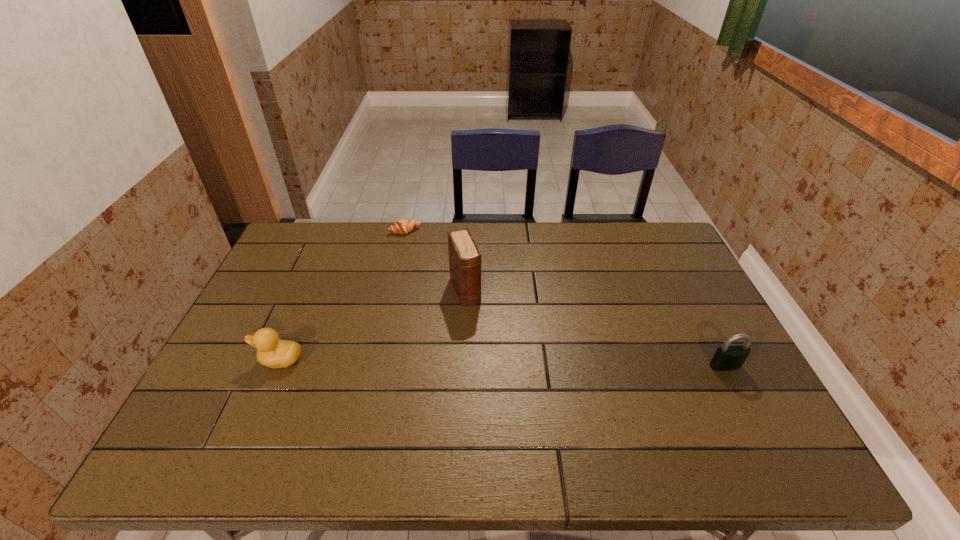
Image resolution: width=960 pixels, height=540 pixels. I want to click on vacant area situated 0.230m on the spine side of the diary, so click(x=495, y=368).

You are a GUI agent. You are given a task and a screenshot of the screen. Output one action in this format:
    pyautogui.click(x=<x>, y=<y>)
    Task: Click on the vacant space located 0.120m on the spine side of the diary
    The image size is (960, 540).
    Given the screenshot: What is the action you would take?
    pyautogui.click(x=482, y=337)

At what (x,y) coordinates should I click in order to perform the action: click on vacant space located 0.270m on the spine side of the diary. Please return your answer as a coordinate pair (x, y). Looking at the image, I should click on (500, 381).

The image size is (960, 540). Identify the location of free space located on the front-facing side of the farthest object. (426, 267).

Where is `vacant space located on the front-facing side of the farthest object`? This screenshot has height=540, width=960. vacant space located on the front-facing side of the farthest object is located at coordinates (418, 249).

At what (x,y) coordinates should I click in order to perform the action: click on vacant space situated on the front-facing side of the farthest object. Please return your answer as a coordinate pair (x, y). Looking at the image, I should click on (426, 267).

This screenshot has height=540, width=960. Identify the location of object situated at the far edge. (402, 226).

Identify the location of object present at the left edge. This screenshot has width=960, height=540. (271, 352).

At what (x,y) coordinates should I click in order to perform the action: click on object present at the right edge. Please return your answer as a coordinate pair (x, y). Looking at the image, I should click on (726, 358).

Find the location of `free space at the far edge of the desktop`. free space at the far edge of the desktop is located at coordinates (494, 240).